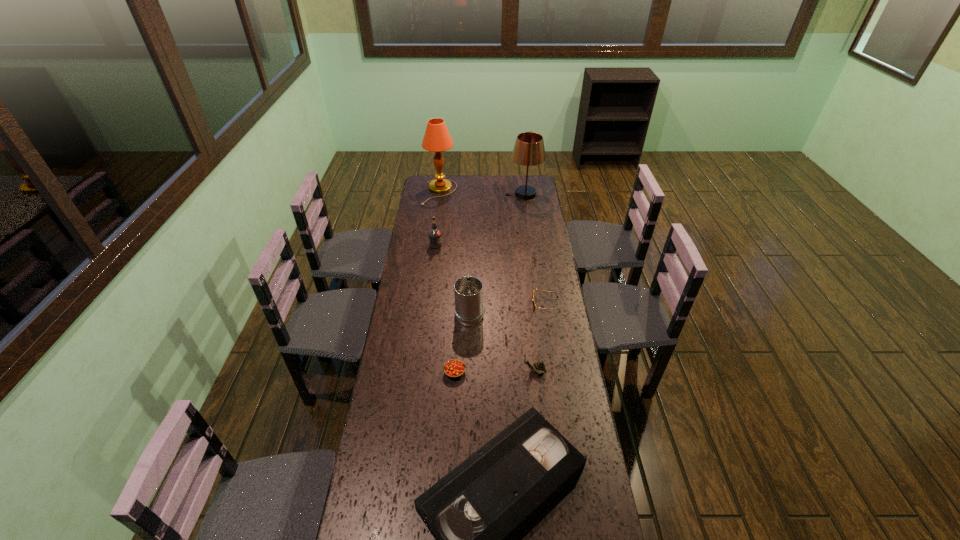
Locate an element on the screen. The image size is (960, 540). vacant space located on the front-facing side of the sunglasses is located at coordinates (455, 304).

Where is `free space located on the front-facing side of the sunglasses`? free space located on the front-facing side of the sunglasses is located at coordinates (453, 304).

The height and width of the screenshot is (540, 960). Identify the location of lamp that is positioned at the far edge. (436, 139).

Locate an element on the screen. lampshade present at the far edge is located at coordinates (529, 150).

The width and height of the screenshot is (960, 540). I want to click on lamp located at the left edge, so click(x=436, y=139).

The height and width of the screenshot is (540, 960). Identify the location of vodka located in the left edge section of the desktop. (435, 235).

In order to click on lampshade present at the right edge in this screenshot , I will do pos(529,150).

Find the location of a particular element. Image resolution: width=960 pixels, height=540 pixels. snail at the right edge is located at coordinates (539, 367).

I want to click on sunglasses located in the right edge section of the desktop, so click(534, 305).

Find the location of a particular element. This screenshot has width=960, height=540. object that is at the far left corner is located at coordinates (436, 139).